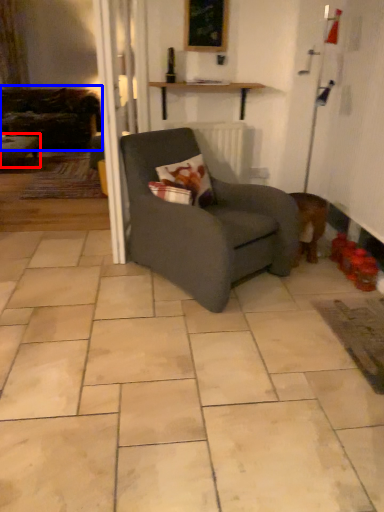
Question: Which point is closer to the camera, table (highlighted by a red box) or studio couch (highlighted by a blue box)?

Choices:
 (A) table
 (B) studio couch

Answer: (A)